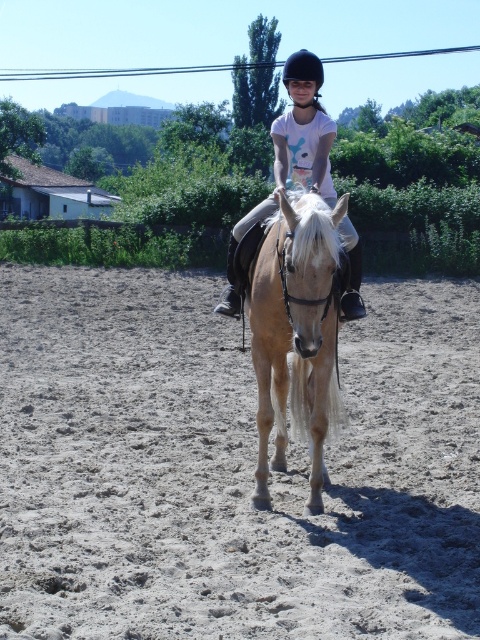
Does point (214, 422) come in front of point (320, 60)?

That is True.

Which is in front, point (3, 300) or point (319, 104)?

Point (319, 104) is more forward.

Identify the location of light brown sandy ground at center. This screenshot has width=480, height=640. (229, 467).

Does light brown sandy ground at center appear under white matte shirt at center?

Yes, light brown sandy ground at center is below white matte shirt at center.

Is point (147, 292) behind point (291, 68)?

Yes, it is.

You are a GUI agent. You are given a task and a screenshot of the screen. Output one action in this format:
    pyautogui.click(x=<x>, y=<y>)
    Task: Click on the light brown sandy ground at center
    This screenshot has height=640, width=480.
    Given the screenshot: What is the action you would take?
    pyautogui.click(x=229, y=467)

Between white matte shirt at center and black hard helmet at center, which one appears on the left side from the viewer's perspective?

From the viewer's perspective, white matte shirt at center appears more on the left side.

Does point (302, 136) come behind point (284, 67)?

No.

Describe the element at coordinates (291, 154) in the screenshot. The width and height of the screenshot is (480, 640). I see `white matte shirt at center` at that location.

Find the location of a particular element. white matte shirt at center is located at coordinates (291, 154).